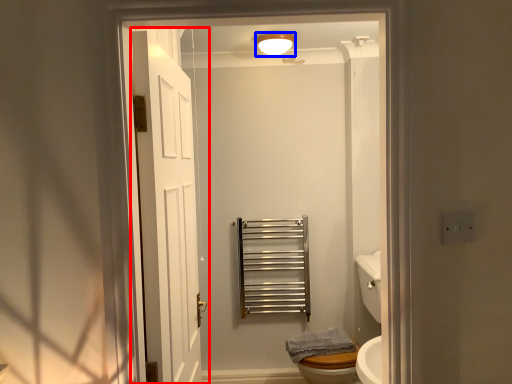
Question: Which object is closer to the camera taking this photo, door (highlighted by a red box) or light fixture (highlighted by a blue box)?

Choices:
 (A) door
 (B) light fixture

Answer: (A)